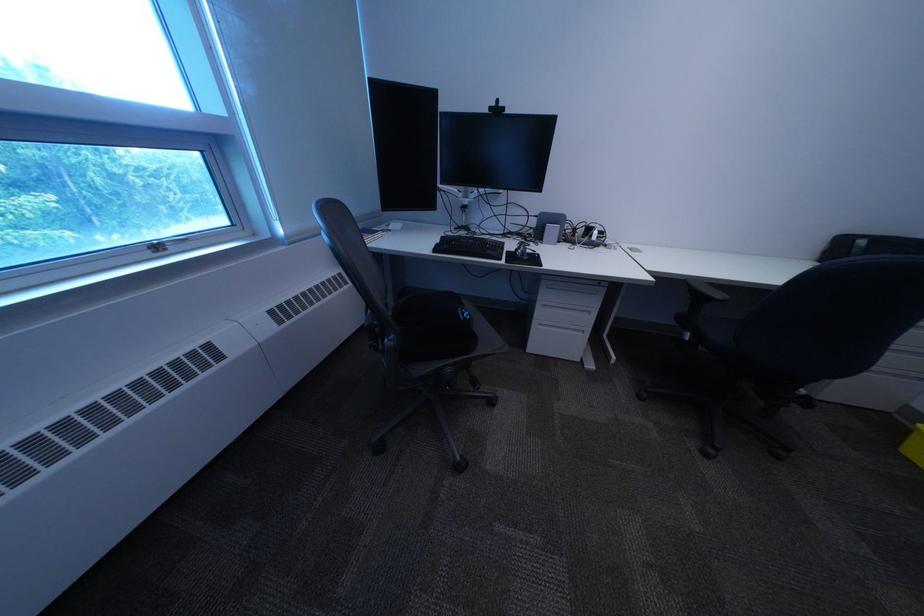
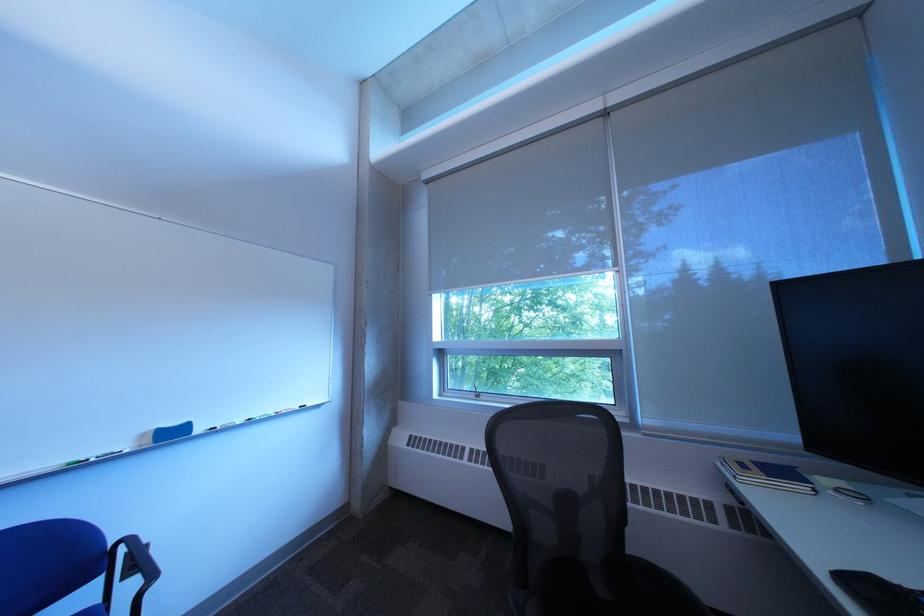
Find the pixel in the second image that matches the point at 451,252 in the first image.

(860, 582)